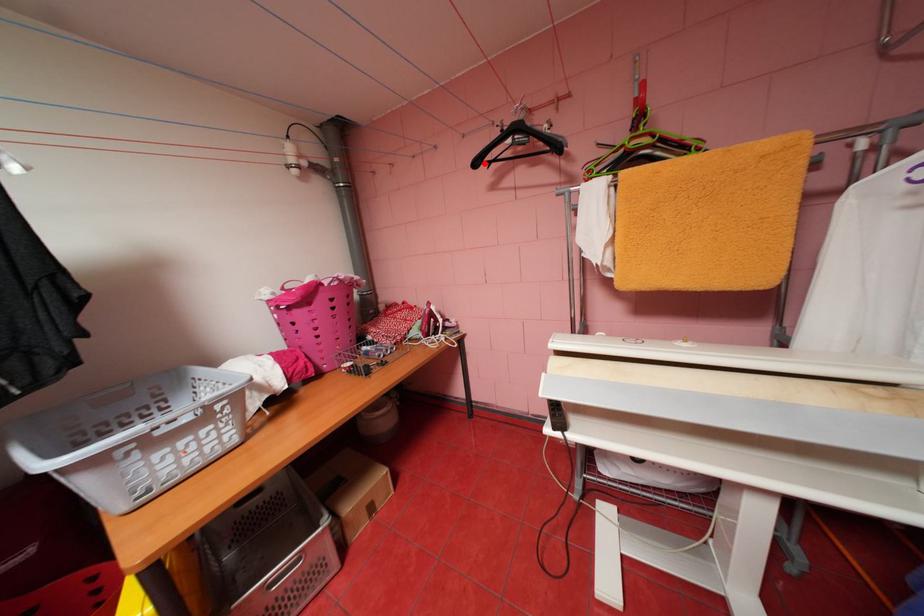
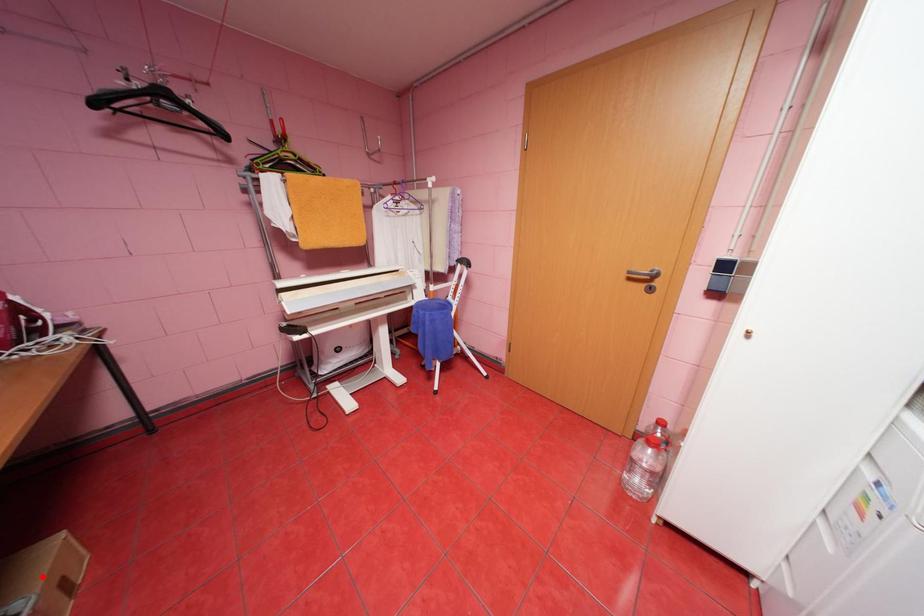
I am providing you with two images of the same scene from different viewpoints. A red point is marked on the first image and another point is marked on the second image. Is the red point in image1 aligned with the point shown in image2?

No